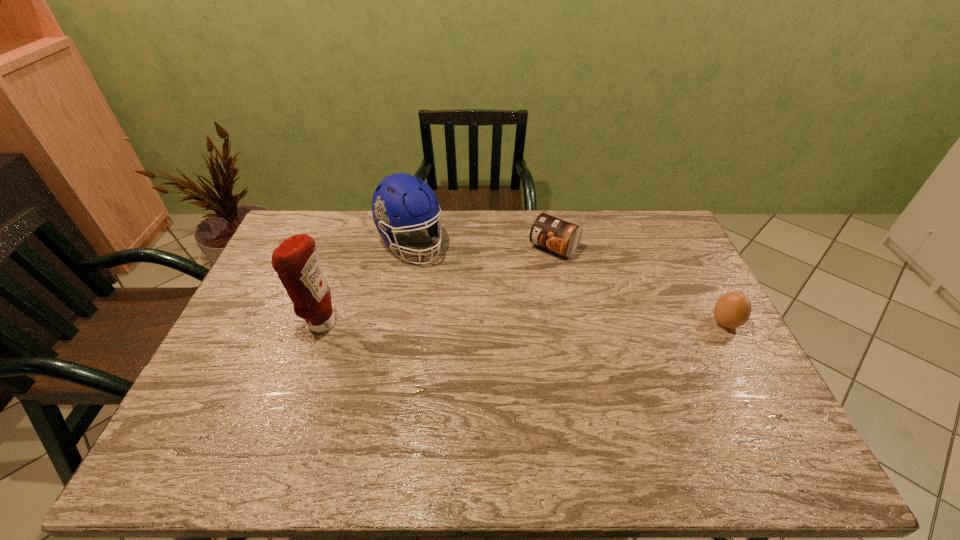
Locate an element on the screen. Image resolution: width=960 pixels, height=540 pixels. blank space located on the face guard of the football helmet is located at coordinates (439, 278).

At what (x,y) coordinates should I click in order to perform the action: click on blank space located 0.300m on the face guard of the football helmet. Please return your answer as a coordinate pair (x, y). This screenshot has height=540, width=960. Looking at the image, I should click on (476, 319).

The image size is (960, 540). What are the coordinates of `vacant area situated 0.200m on the face guard of the football helmet` in the screenshot? It's located at (459, 299).

The height and width of the screenshot is (540, 960). What are the coordinates of `can that is at the far edge` in the screenshot? It's located at (557, 235).

Locate an element on the screen. football helmet situated at the far edge is located at coordinates (402, 195).

Where is `object that is at the right edge`? This screenshot has width=960, height=540. object that is at the right edge is located at coordinates (733, 309).

You are a GUI agent. You are given a task and a screenshot of the screen. Output one action in this format:
    pyautogui.click(x=<x>, y=<y>)
    Task: Click on the free region at the far edge of the desktop
    The width and height of the screenshot is (960, 540).
    Given the screenshot: What is the action you would take?
    pyautogui.click(x=341, y=227)

In the image, there is a desktop. Find the location of `vacant space at the near edge`. vacant space at the near edge is located at coordinates (666, 401).

This screenshot has width=960, height=540. I want to click on free point at the left edge, so click(280, 281).

Where is `blank area at the right edge`? Image resolution: width=960 pixels, height=540 pixels. blank area at the right edge is located at coordinates (677, 340).